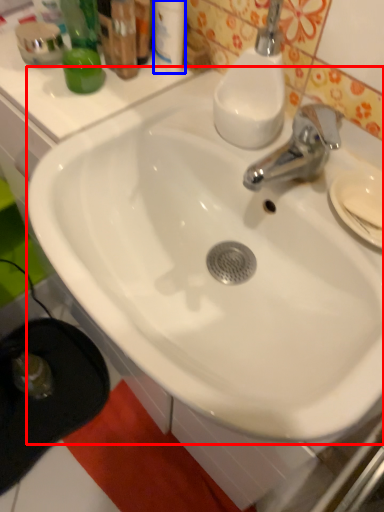
Question: Which point is closer to the camera, sink (highlighted by a red box) or toiletry (highlighted by a blue box)?

Choices:
 (A) sink
 (B) toiletry

Answer: (A)